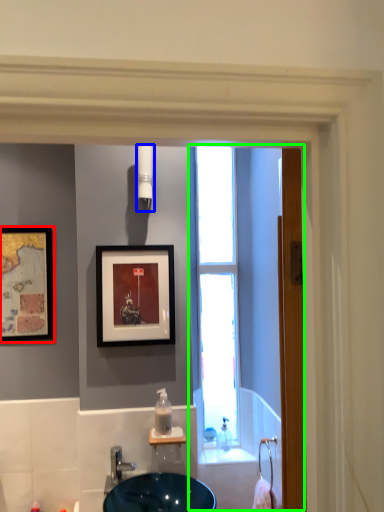
Question: Considering the real-world distances, which object is closest to picture frame (highlighted by a red box)? light fixture (highlighted by a blue box) or screen door (highlighted by a green box).

Choices:
 (A) light fixture
 (B) screen door

Answer: (A)